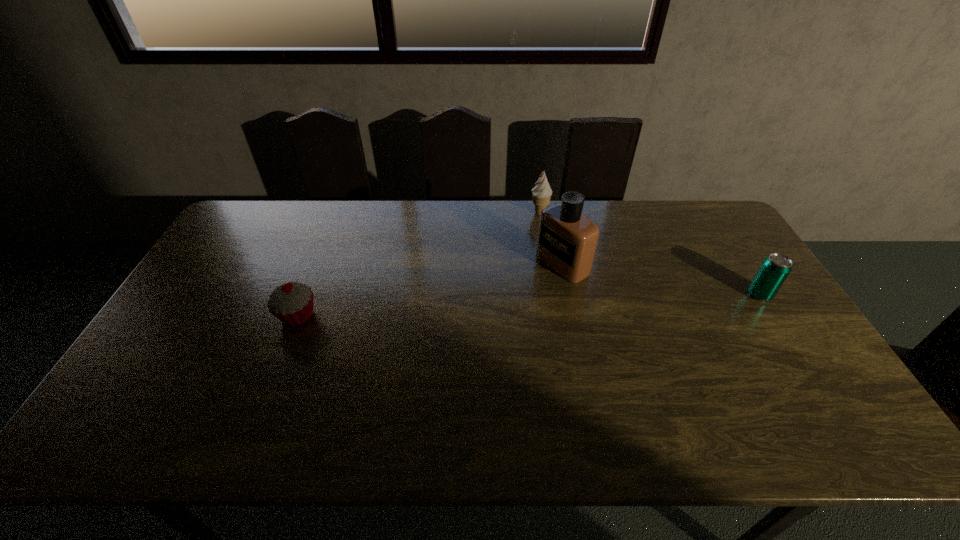
At what (x,y) coordinates should I click in order to perform the action: click on free space at the near left corner of the desktop. Please return your answer as a coordinate pair (x, y). The image size is (960, 540). Looking at the image, I should click on (149, 405).

Where is `vacant space at the far right corner of the desktop`? Image resolution: width=960 pixels, height=540 pixels. vacant space at the far right corner of the desktop is located at coordinates (715, 206).

This screenshot has height=540, width=960. I want to click on free location at the near right corner of the desktop, so tap(806, 386).

Where is `free area in between the beer can and the leftmost object`? This screenshot has width=960, height=540. free area in between the beer can and the leftmost object is located at coordinates (528, 305).

Image resolution: width=960 pixels, height=540 pixels. I want to click on vacant space in between the leftmost object and the tallest object, so click(430, 290).

Where is `free space between the beer can and the perfume`? The width and height of the screenshot is (960, 540). free space between the beer can and the perfume is located at coordinates (660, 279).

The height and width of the screenshot is (540, 960). What are the coordinates of `free point between the beer can and the perfume` in the screenshot? It's located at [x=660, y=279].

Locate an element on the screen. This screenshot has width=960, height=540. free space that is in between the cupcake and the third nearest object is located at coordinates (430, 290).

This screenshot has height=540, width=960. Find the location of `free spot between the icecream and the cupcake`. free spot between the icecream and the cupcake is located at coordinates (419, 264).

Identify the location of vacant space in between the beer can and the leftmost object. (528, 305).